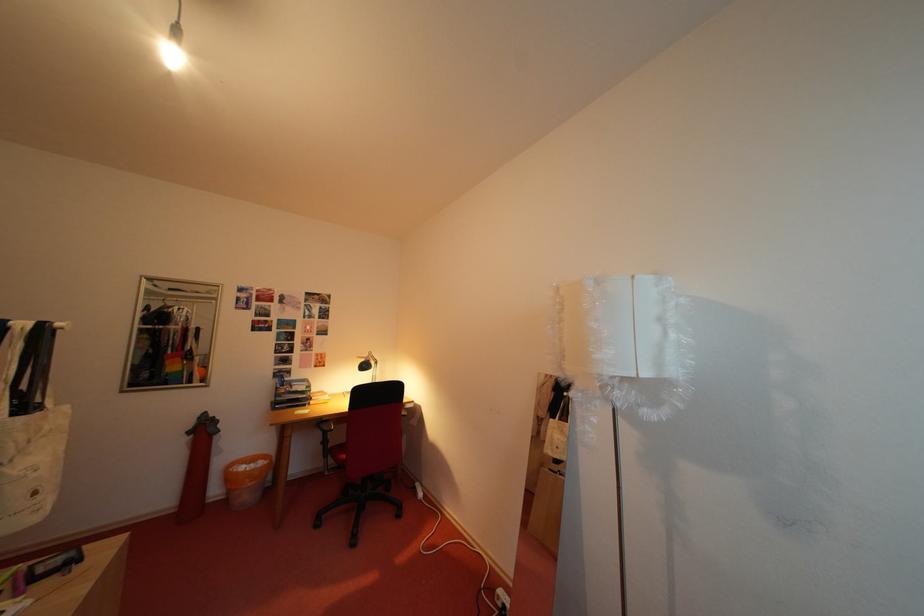
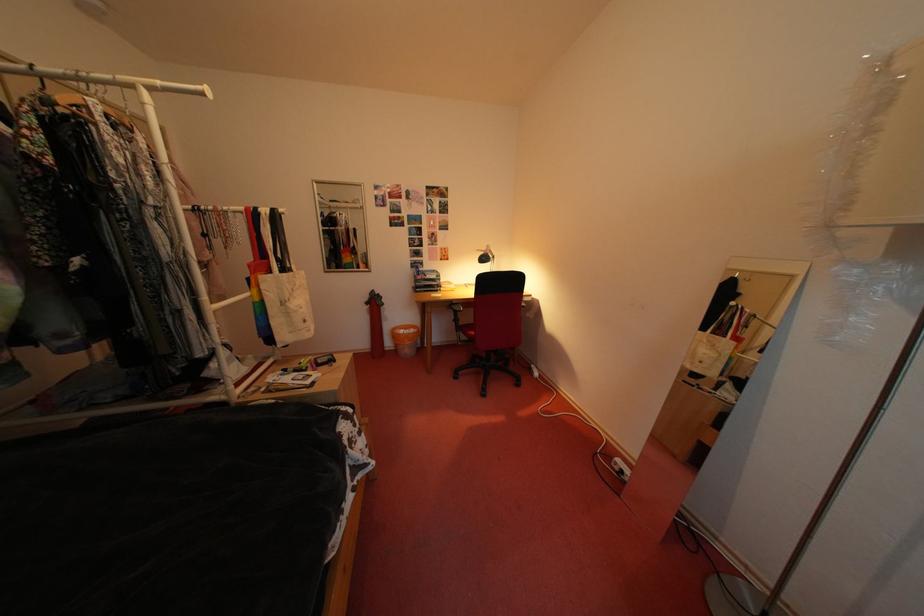
The point at (252, 472) is marked in the first image. Where is the corresponding point in the second image?

(411, 336)